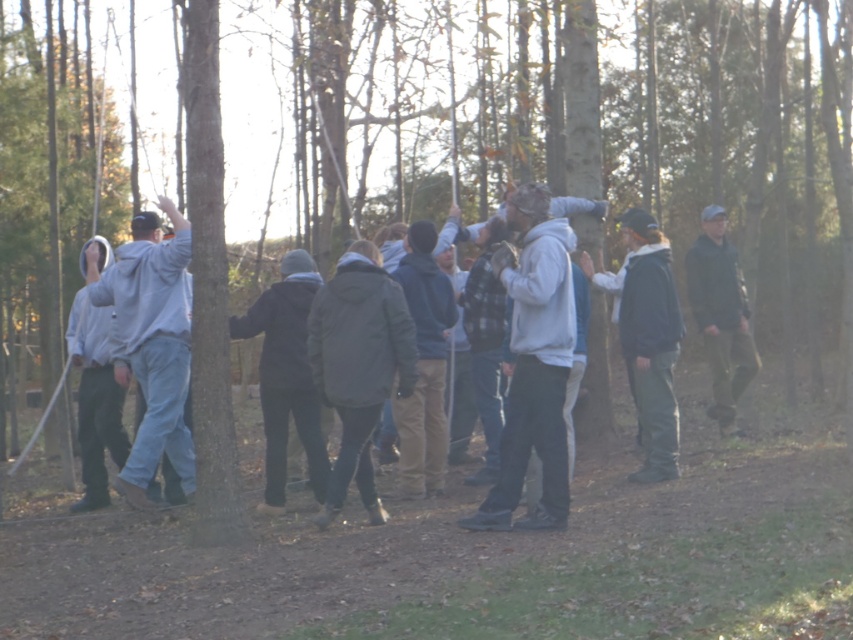
Does point (553, 340) come farther from viewer compared to point (120, 362)?

No, (553, 340) is closer to viewer.

This screenshot has height=640, width=853. What do you see at coordinates (534, 362) in the screenshot?
I see `matte gray hoodie at center` at bounding box center [534, 362].

The height and width of the screenshot is (640, 853). I want to click on matte gray hoodie at center, so click(534, 362).

Can you confirm if matte gray hoodie at center is positioned above dark green fabric jacket at right?

Incorrect, matte gray hoodie at center is not positioned above dark green fabric jacket at right.

The image size is (853, 640). What are the coordinates of `matte gray hoodie at center` in the screenshot? It's located at (534, 362).

You are a GUI agent. You are given a task and a screenshot of the screen. Output one action in this format:
    pyautogui.click(x=<x>, y=<y>)
    Task: Click on the matte gray hoodie at center
    
    Given the screenshot: What is the action you would take?
    pyautogui.click(x=534, y=362)

Does matte gray hoodie at center appear over dark gray hoodie at center?

Yes.

Between point (506, 209) and point (677, 436), which one is positioned behind?

Point (677, 436)

Identify the location of matte gray hoodie at center. (534, 362).